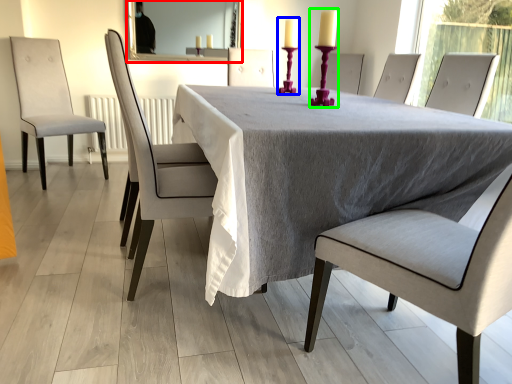
Question: Considering the real-world distances, which object is closest to mirror (highlighted by a red box)? candle holder (highlighted by a blue box) or candle holder (highlighted by a green box).

Choices:
 (A) candle holder
 (B) candle holder

Answer: (A)